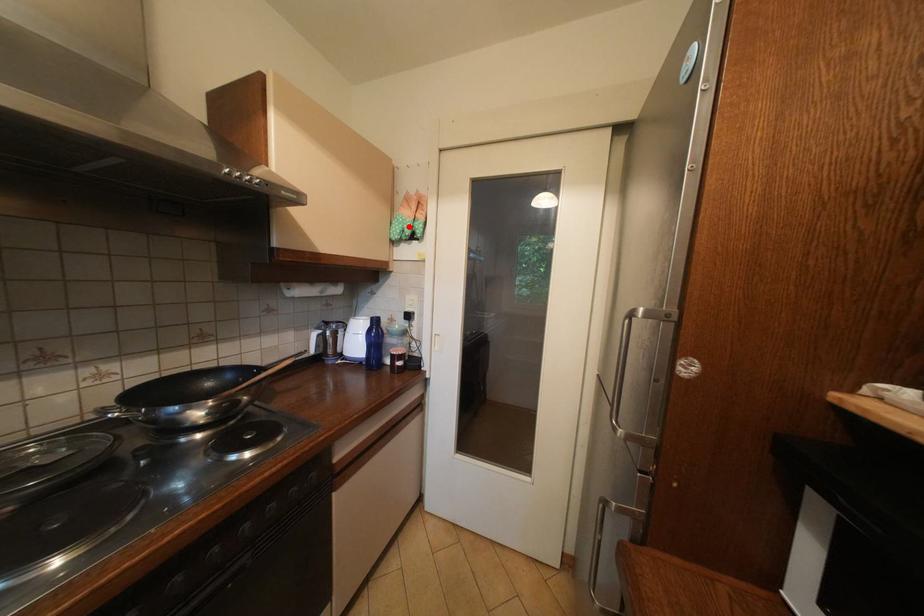
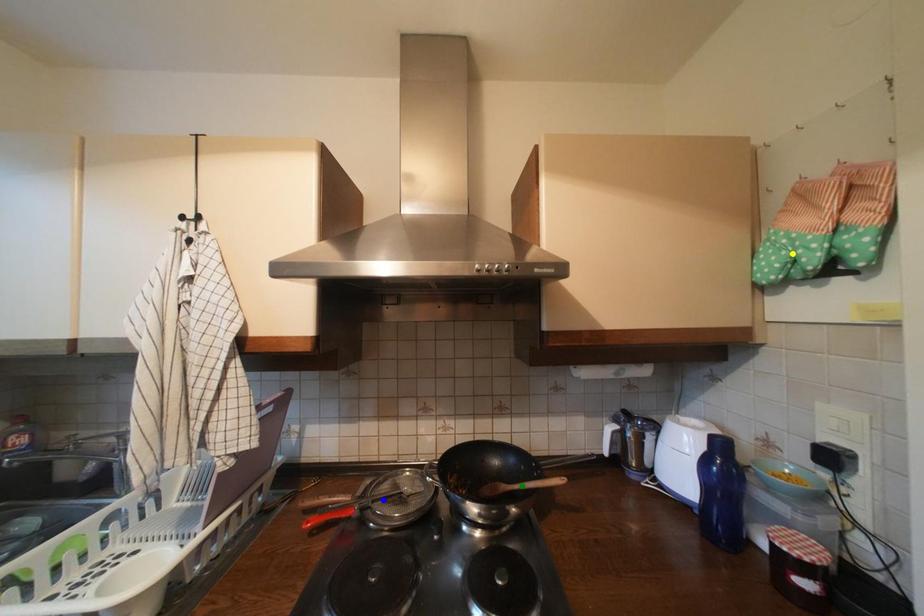
Question: I am providing you with two images of the same scene from different viewpoints. A red point is marked on the first image. You are given multiple points on the second image. Which point in image 2 represents the same 3d spot as the red point in image 1?

Choices:
 (A) blue point
 (B) green point
 (C) yellow point

Answer: (C)